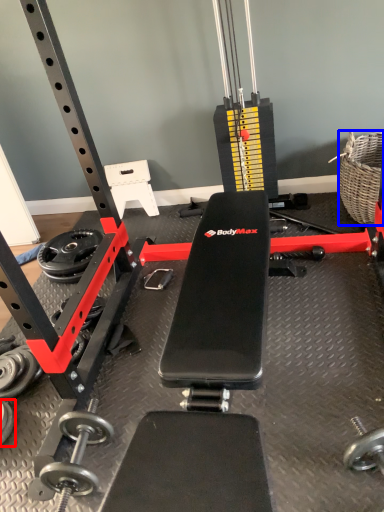
Question: Which object is further to the camera taking this photo, dumbbell (highlighted by a red box) or basket (highlighted by a blue box)?

Choices:
 (A) dumbbell
 (B) basket

Answer: (B)